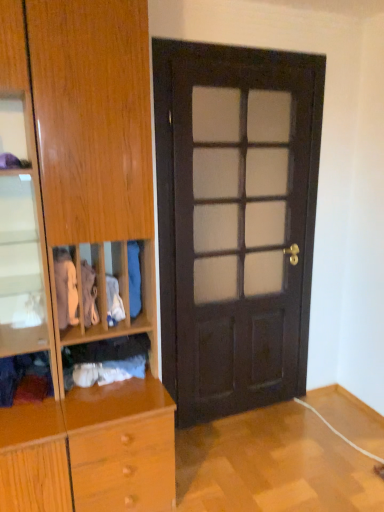
Question: Does dark wood door at center have a greater height compared to white cotton shirt at left, which is the fifth clothing from right to left?

Choices:
 (A) no
 (B) yes

Answer: (B)

Question: Considering the relative sizes of dark wood door at center and white cotton shirt at left, which appears as the 2th clothing when viewed from the left, in the image provided, is dark wood door at center shorter than white cotton shirt at left, which appears as the 2th clothing when viewed from the left,?

Choices:
 (A) yes
 (B) no

Answer: (B)

Question: Is dark wood door at center thinner than white cotton shirt at left, which appears as the 2th clothing when viewed from the left?

Choices:
 (A) no
 (B) yes

Answer: (B)

Question: Can you confirm if dark wood door at center is wider than white cotton shirt at left, which appears as the 2th clothing when viewed from the left?

Choices:
 (A) yes
 (B) no

Answer: (B)

Question: Can you see dark wood door at center touching white cotton shirt at left, which appears as the 2th clothing when viewed from the left?

Choices:
 (A) yes
 (B) no

Answer: (B)

Question: Is dark wood door at center not inside white cotton shirt at left, which is the fifth clothing from right to left?

Choices:
 (A) yes
 (B) no

Answer: (A)

Question: Is dark wood door at center in contact with blue fabric at center, the 1th clothing positioned from the right?

Choices:
 (A) no
 (B) yes

Answer: (A)

Question: From a real-world perspective, is dark wood door at center located higher than blue fabric at center, the 1th clothing positioned from the right?

Choices:
 (A) yes
 (B) no

Answer: (A)

Question: Are dark wood door at center and blue fabric at center, the 1th clothing positioned from the right, far apart?

Choices:
 (A) no
 (B) yes

Answer: (A)

Question: Considering the relative positions of dark wood door at center and blue fabric at center, the 1th clothing positioned from the right, in the image provided, is dark wood door at center to the right of blue fabric at center, the 1th clothing positioned from the right, from the viewer's perspective?

Choices:
 (A) no
 (B) yes

Answer: (B)

Question: Is dark wood door at center smaller than blue fabric at center, the sixth clothing from the left?

Choices:
 (A) yes
 (B) no

Answer: (B)

Question: Does dark wood door at center have a greater height compared to blue fabric at center, the 1th clothing positioned from the right?

Choices:
 (A) no
 (B) yes

Answer: (B)

Question: Is velvet purple scarf at lower left, placed as the 1th clothing when sorted from left to right, to the right of white cotton shirt at center, the 2th clothing positioned from the right, from the viewer's perspective?

Choices:
 (A) no
 (B) yes

Answer: (A)